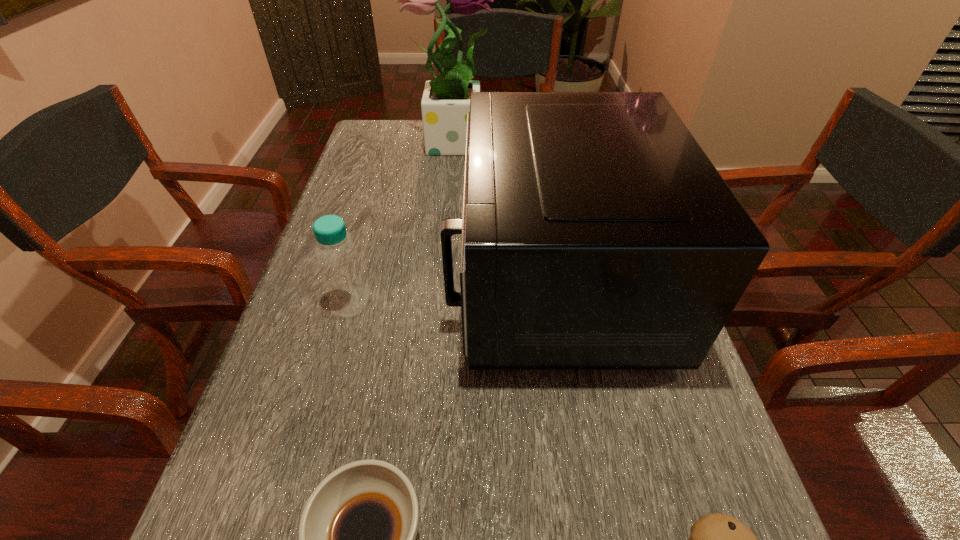
Identify the location of free location that satisfies the following two spatial constraints: 1. on the front-facing side of the tallest object; 2. on the front side of the leftmost object. (436, 302).